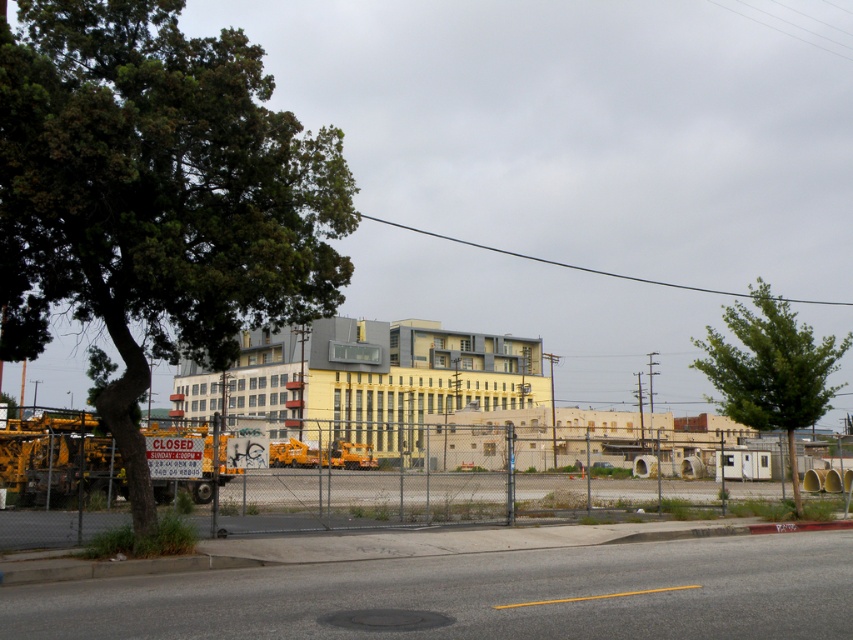
You are a construction worker planning to install a new light pole between the green leafy tree at left and the green leafy tree at lower right. Which tree should the pole be closer to if you want it to be at the same height as the shorter tree?

The green leafy tree at left is shorter than the green leafy tree at lower right. To have the light pole at the same height as the shorter tree, place it closer to the green leafy tree at left.

You are a construction worker who needs to move a heavy crate from the green leafy tree at left to the green leafy tree at lower right. Which tree should you place the crate closer to the front of the site?

The green leafy tree at left is in front of the green leafy tree at lower right, so you should place the crate closer to the green leafy tree at left since it is positioned in front.

You are a pedestrian standing at the edge of the construction site. You see the green leafy tree at lower right and the yellow matte school bus at center. Which object is taller?

The green leafy tree at lower right is taller than the yellow matte school bus at center according to the description.